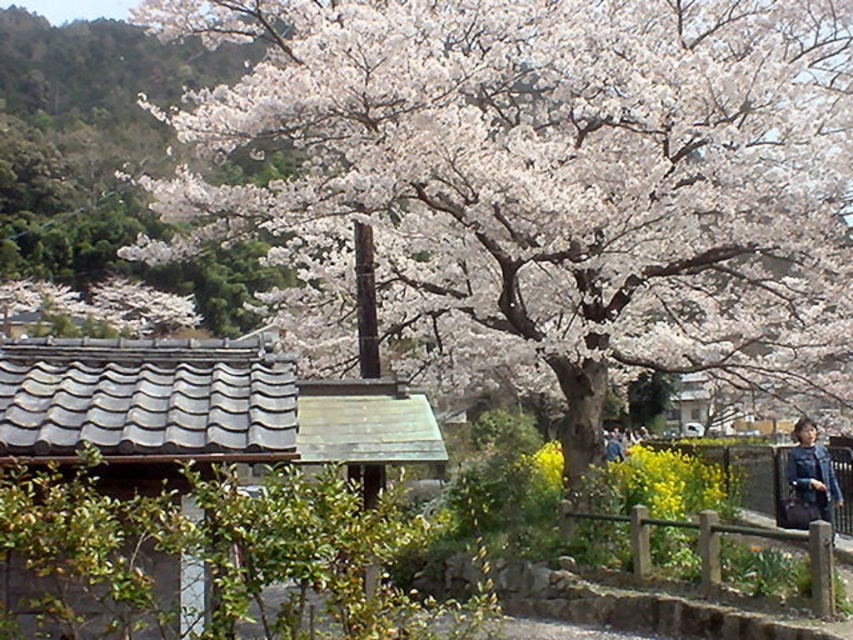
Which of these two, white blossoms at center or blue fabric jacket at lower right, stands taller?

With more height is white blossoms at center.

Find the location of `white blossoms at center`. white blossoms at center is located at coordinates (555, 170).